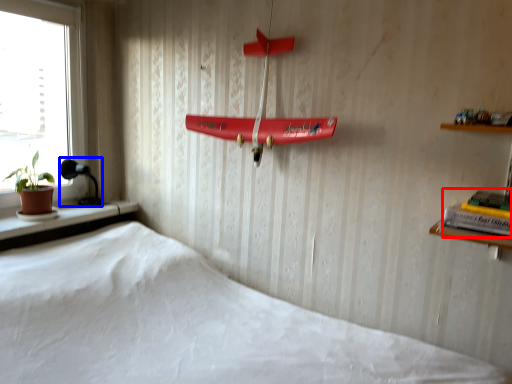
Question: Which object is further to the camera taking this photo, book (highlighted by a red box) or lamp (highlighted by a blue box)?

Choices:
 (A) book
 (B) lamp

Answer: (B)